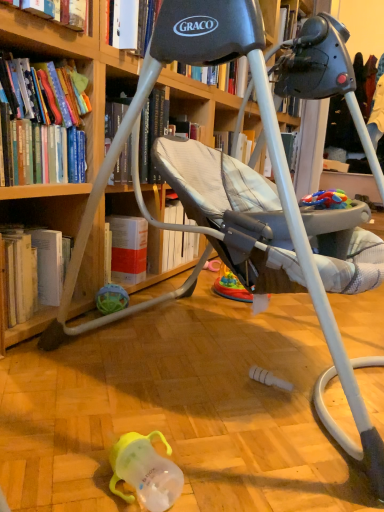
Question: From the image's perspective, is hardcover book at upper left, which appears as the first book when viewed from the top, positioned above or below hardcover book at upper left, marked as the 2th book in a bottom-to-top arrangement?

Choices:
 (A) above
 (B) below

Answer: (A)

Question: Does point (56, 10) appear closer or farther from the camera than point (39, 88)?

Choices:
 (A) farther
 (B) closer

Answer: (B)

Question: Based on their relative distances, which object is farther from the hardcover book at upper left, acting as the third book starting from the bottom?

Choices:
 (A) hardcover book at upper left, marked as the 2th book in a bottom-to-top arrangement
 (B) translucent rubber ball at lower left, which is the 2th toy in right-to-left order
 (C) wooden bookcase at upper left
 (D) rubberized plastic toy at right, placed as the 1th toy when sorted from top to bottom
 (E) hardcover book at lower left, the first book when ordered from bottom to top

Answer: (B)

Question: Which is farther from the hardcover book at upper left, acting as the third book starting from the bottom?

Choices:
 (A) wooden bookcase at upper left
 (B) hardcover book at upper left, marked as the 2th book in a bottom-to-top arrangement
 (C) hardcover book at lower left, which is the 3th book from top to bottom
 (D) rubberized plastic toy at right, which appears as the first toy when viewed from the right
 (E) translucent rubber ball at lower left, the first toy ordered from the bottom

Answer: (E)